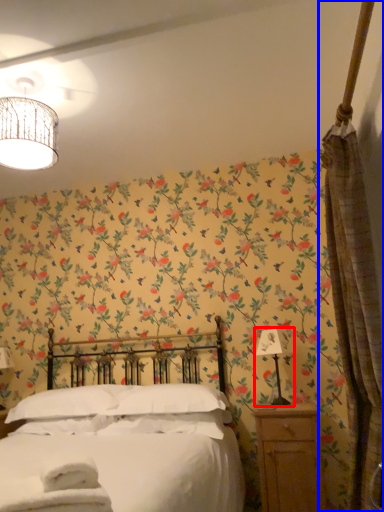
Question: Which object is closer to the camera taking this photo, bedside lamp (highlighted by a red box) or curtain (highlighted by a blue box)?

Choices:
 (A) bedside lamp
 (B) curtain

Answer: (B)